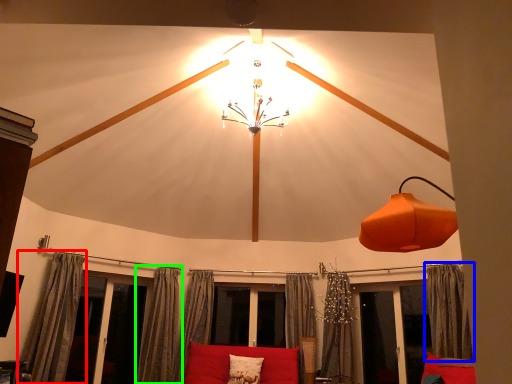
Question: Which is farther away from curtain (highlighted by a red box)? curtain (highlighted by a blue box) or curtain (highlighted by a green box)?

Choices:
 (A) curtain
 (B) curtain

Answer: (A)